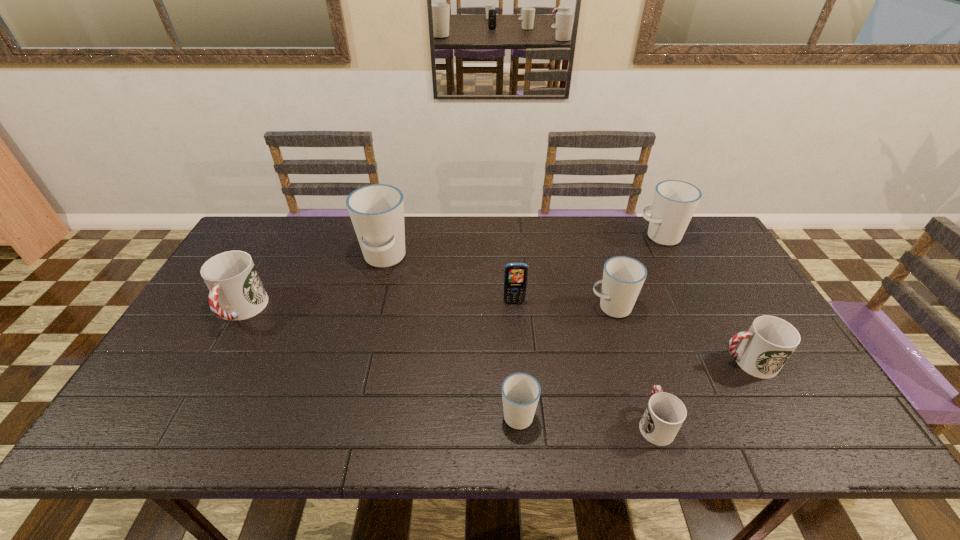
Locate an element on the screen. The height and width of the screenshot is (540, 960). vacant space located 0.120m on the screen of the cellular telephone is located at coordinates (516, 336).

Find the location of a particular element. Image resolution: width=960 pixels, height=540 pixels. free region located 0.320m with a handle on the side of the second nearest white cup is located at coordinates (476, 307).

At what (x,y) coordinates should I click in order to perform the action: click on free space located with a handle on the side of the second nearest white cup. Please return your answer as a coordinate pair (x, y). The image size is (960, 540). Looking at the image, I should click on (571, 307).

Where is `free region located with a handle on the side of the second nearest white cup`? The height and width of the screenshot is (540, 960). free region located with a handle on the side of the second nearest white cup is located at coordinates (550, 307).

Where is `blank area located 0.370m on the handle side of the rightmost red cup`? Image resolution: width=960 pixels, height=540 pixels. blank area located 0.370m on the handle side of the rightmost red cup is located at coordinates (572, 362).

Image resolution: width=960 pixels, height=540 pixels. What are the coordinates of `vacant space positioned on the handle side of the rightmost red cup` in the screenshot? It's located at (596, 362).

Image resolution: width=960 pixels, height=540 pixels. What are the coordinates of `free space located 0.170m on the handle side of the rightmost red cup` in the screenshot? It's located at (652, 362).

The height and width of the screenshot is (540, 960). Identify the location of vacant region located 0.130m with a handle on the side of the smallest white cup. (514, 352).

Identify the location of vacant space located with a handle on the side of the smallest white cup. (510, 293).

This screenshot has height=540, width=960. I want to click on vacant space situated 0.370m with a handle on the side of the smallest white cup, so click(509, 288).